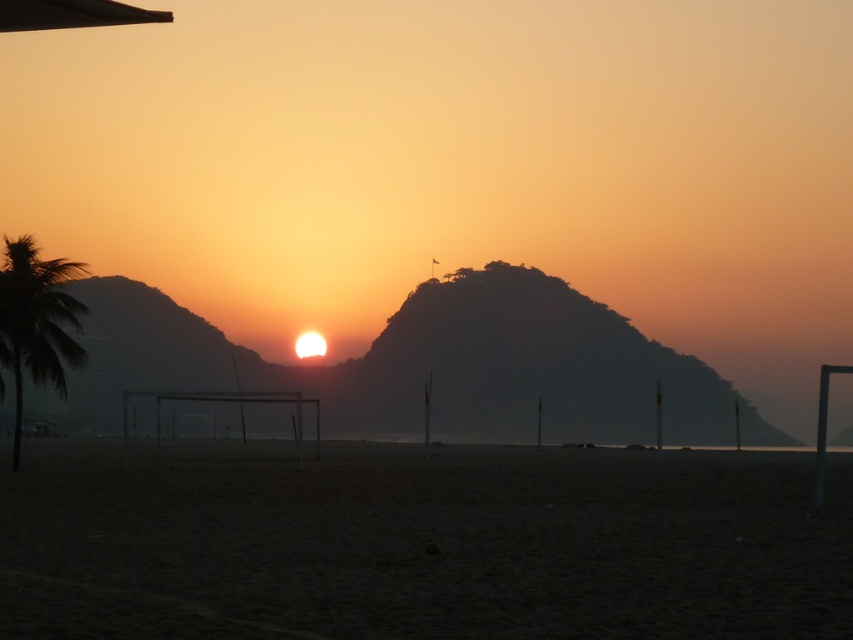
Consider the image. You are on a beach at sunset and want to place a picnic blanket between the silhouette rock at center and the green leafy palm tree at left. The blanket requires 40 feet of space. Can you fit it there?

The silhouette rock at center is 51.36 feet away from the green leafy palm tree at left, so yes, the picnic blanket requiring 40 feet of space can fit between them since the distance is sufficient.

You are standing at the edge of the beach and want to place a small flag exactly where the dark sand at lower center is located. According to the coordinates provided, what are the exact coordinates where you should place the flag?

The dark sand at lower center is located at point [421,545], so you should place the flag at those coordinates.

You are standing on the beach and want to place a small flag exactly between the dark sand at lower center and the silhouette rock at center. Where should you place the flag?

The dark sand at lower center is positioned under the silhouette rock at center, so placing the flag directly beneath the silhouette rock at center would place it between the two objects.